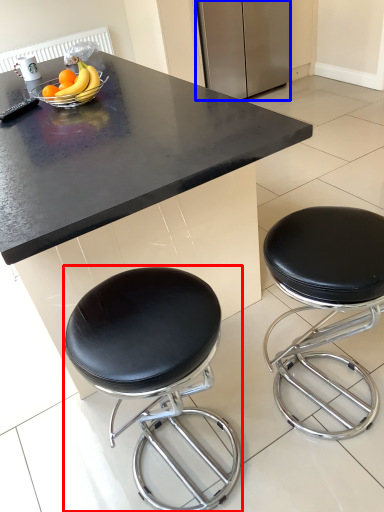
Question: Which point is closer to the camera, stool (highlighted by a red box) or appliance (highlighted by a blue box)?

Choices:
 (A) stool
 (B) appliance

Answer: (A)